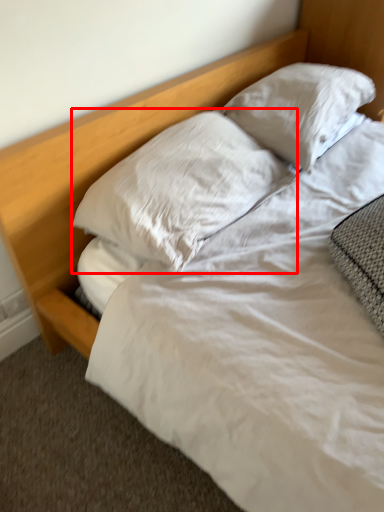
Question: From the image's perspective, where is pillow (annotated by the red box) located relative to pillow?

Choices:
 (A) below
 (B) above

Answer: (A)